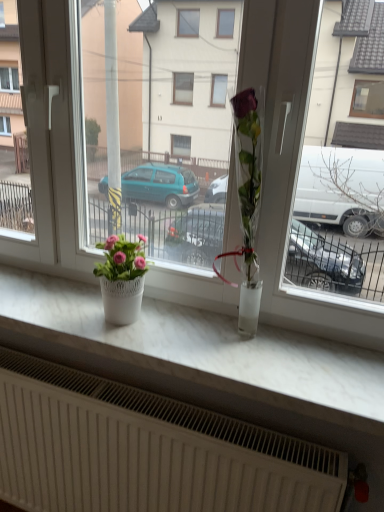
Image resolution: width=384 pixels, height=512 pixels. I want to click on unoccupied region to the right of pink matte flower pot at left, so click(178, 323).